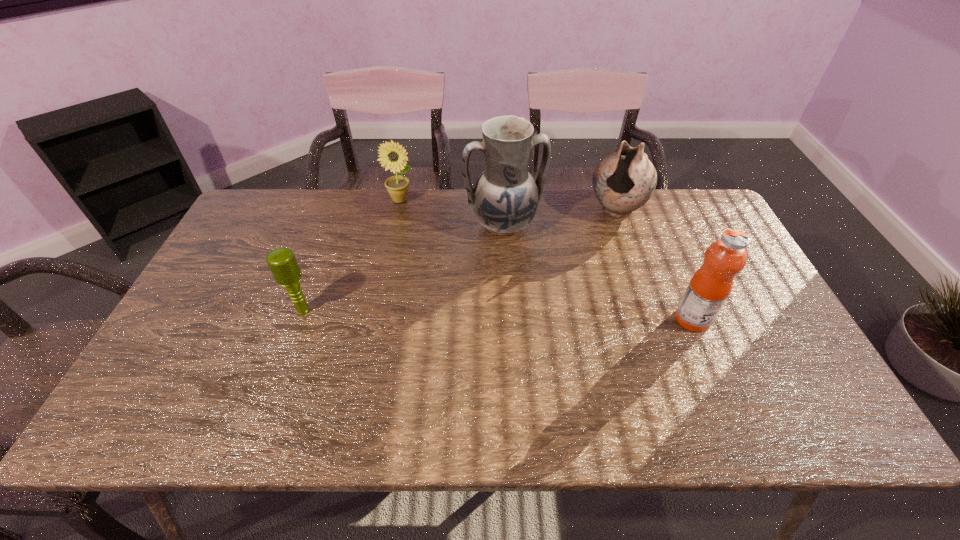
The image size is (960, 540). I want to click on vacant space that satisfies the following two spatial constraints: 1. on the front side of the second object from left to right; 2. on the front label of the fruit juice, so click(x=374, y=319).

You are a GUI agent. You are given a task and a screenshot of the screen. Output one action in this format:
    pyautogui.click(x=<x>, y=<y>)
    Task: Click on the blank space that satisfies the following two spatial constraints: 1. on the front side of the second object from left to right; 2. on the front label of the fruit juice
    
    Given the screenshot: What is the action you would take?
    pyautogui.click(x=374, y=319)